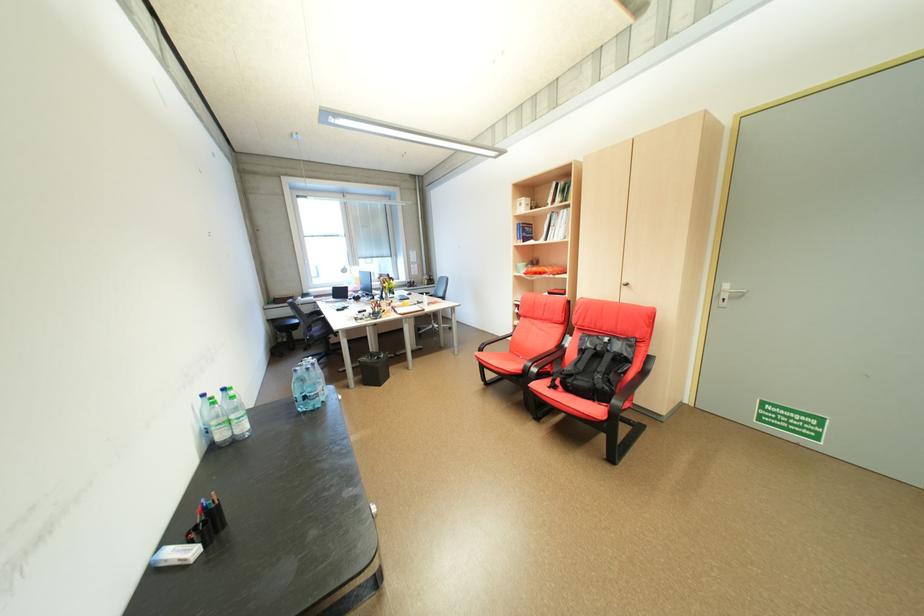
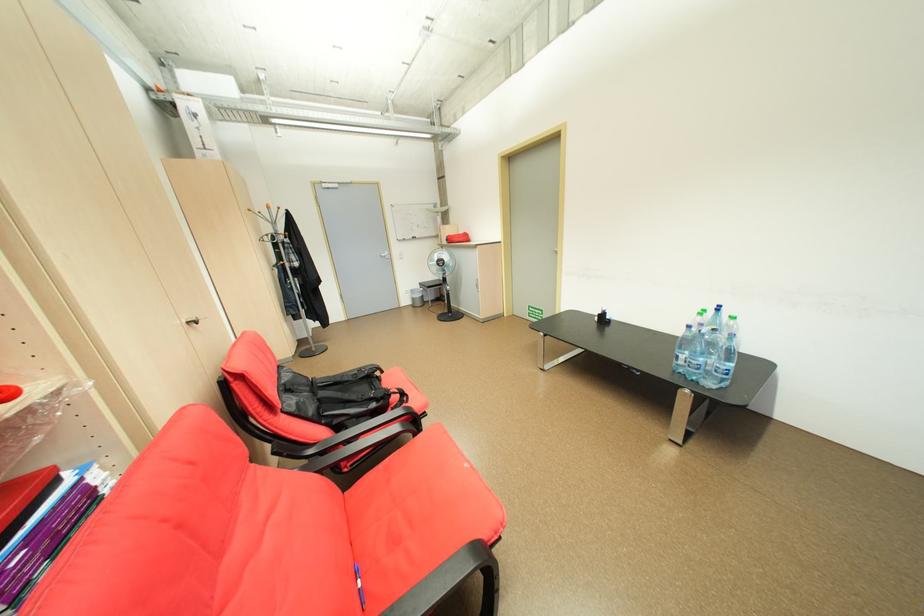
In the second image, find the point that corresponds to the point at 213,509 in the first image.

(613, 313)